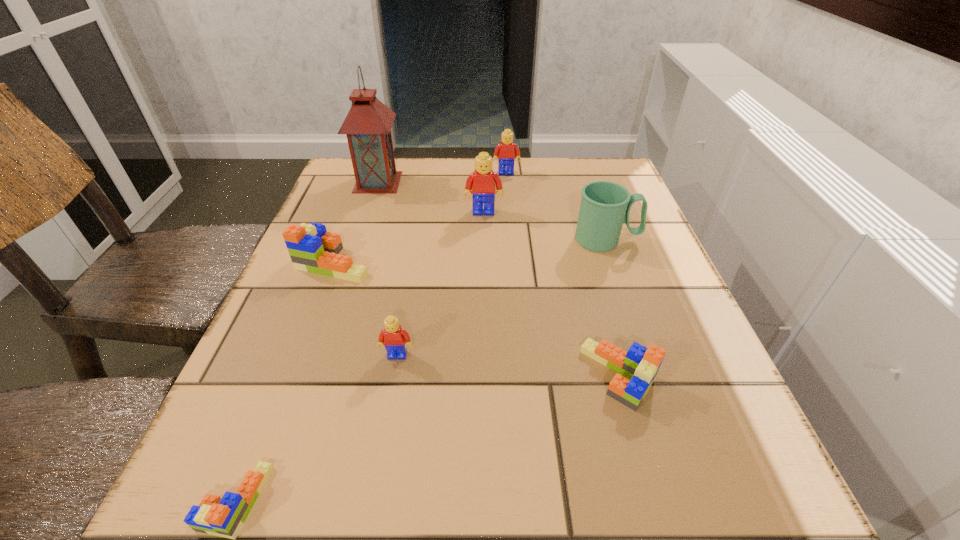
You are a GUI agent. You are given a task and a screenshot of the screen. Output one action in this format:
    pyautogui.click(x=<x>, y=<y>)
    Task: Click on the vacant area between the nearest Lego and the second tallest Lego
    The image size is (960, 540).
    Given the screenshot: What is the action you would take?
    pyautogui.click(x=371, y=336)

Find the location of `free space between the smallest yellow Lego and the rightmost orange Lego`. free space between the smallest yellow Lego and the rightmost orange Lego is located at coordinates point(508,365).

Locate an element on the screen. The image size is (960, 540). free spot between the nearest yellow Lego and the shortest object is located at coordinates pos(317,428).

Locate an element on the screen. This screenshot has width=960, height=540. vacant space that is in between the third farthest Lego and the biggest yellow Lego is located at coordinates (409, 237).

Select which object appears as the third closest to the second smallest orange Lego. Please provide its 2D coordinates. Your answer should be formatted as a tuple, i.e. [(x, y)], where the tuple contains the x and y coordinates of a point satisfying the conditions above.

[(482, 181)]

Point out which object is positioned as the nearest to the seventh shortest object. Please provide its 2D coordinates. Your answer should be formatted as a tuple, i.e. [(x, y)], where the tuple contains the x and y coordinates of a point satisfying the conditions above.

[(505, 151)]

Point out which Lego is positioned as the nearest to the farthest orange Lego. Please provide its 2D coordinates. Your answer should be formatted as a tuple, i.e. [(x, y)], where the tuple contains the x and y coordinates of a point satisfying the conditions above.

[(395, 339)]

Identify the location of Lego that is the closest to the biggest yellow Lego. (505, 151).

Identify the location of yellow Lego object that ranks as the closest to the green mug. Image resolution: width=960 pixels, height=540 pixels. (482, 181).

Choose which yellow Lego is the nearest neighbor to the fifth shortest Lego. Please provide its 2D coordinates. Your answer should be formatted as a tuple, i.e. [(x, y)], where the tuple contains the x and y coordinates of a point satisfying the conditions above.

[(482, 181)]